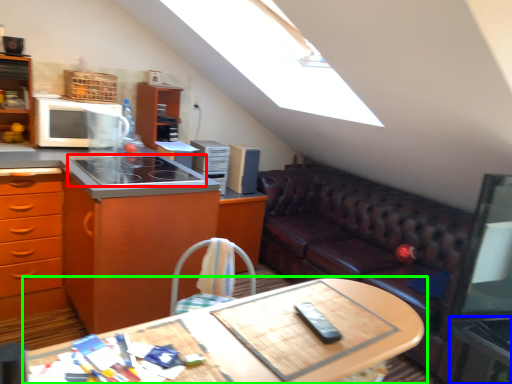
Question: Based on their relative distances, which object is nearer to gas stove (highlighted by a red box)? Choose from side table (highlighted by a blue box) and table (highlighted by a green box).

Choices:
 (A) side table
 (B) table

Answer: (B)